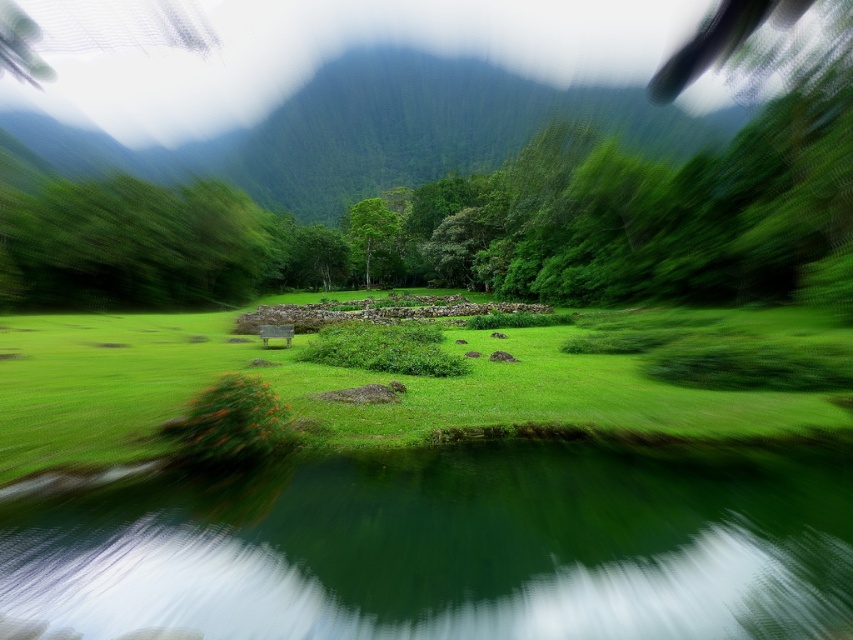
You are standing at the edge of the green smooth water at lower center and want to walk to the green matte tree at center. Which direction should you head to reach the tree?

The green smooth water at lower center is thinner than the green matte tree at center, so you should head towards the thicker area where the green matte tree at center is located to reach it.

You are standing on the green grassy at center and want to look up to see the green leafy mountain at upper center. Is the mountain directly above you?

Yes, the green leafy mountain at upper center is directly above the green grassy at center since the grassy area is positioned under the mountain.

You are standing at the edge of the calm body of water in the foreground. Which object, the green grassy at center or the green leafy mountain at upper center, is positioned to the right when facing towards the middle ground?

The green grassy at center is positioned to the right of the green leafy mountain at upper center.